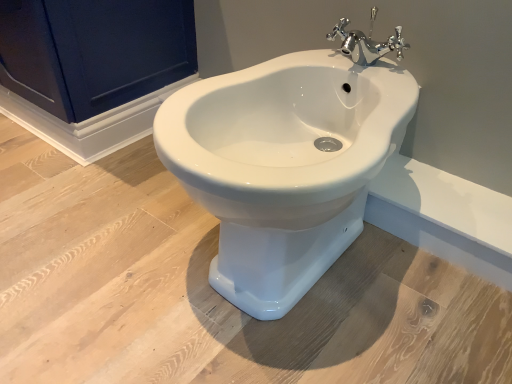
Question: Considering the relative sizes of matte dark blue cabinet at upper left and chrome metallic faucet at upper center in the image provided, is matte dark blue cabinet at upper left bigger than chrome metallic faucet at upper center?

Choices:
 (A) yes
 (B) no

Answer: (A)

Question: Is the position of matte dark blue cabinet at upper left less distant than that of chrome metallic faucet at upper center?

Choices:
 (A) no
 (B) yes

Answer: (A)

Question: Is matte dark blue cabinet at upper left beside chrome metallic faucet at upper center?

Choices:
 (A) no
 (B) yes

Answer: (A)

Question: Could you tell me if matte dark blue cabinet at upper left is facing chrome metallic faucet at upper center?

Choices:
 (A) yes
 (B) no

Answer: (B)

Question: Is chrome metallic faucet at upper center at the back of matte dark blue cabinet at upper left?

Choices:
 (A) no
 (B) yes

Answer: (A)

Question: From a real-world perspective, does matte dark blue cabinet at upper left stand above chrome metallic faucet at upper center?

Choices:
 (A) yes
 (B) no

Answer: (B)

Question: From a real-world perspective, is white glossy bidet at center over matte dark blue cabinet at upper left?

Choices:
 (A) no
 (B) yes

Answer: (A)

Question: Is white glossy bidet at center at the left side of matte dark blue cabinet at upper left?

Choices:
 (A) no
 (B) yes

Answer: (A)

Question: Is white glossy bidet at center taller than matte dark blue cabinet at upper left?

Choices:
 (A) yes
 (B) no

Answer: (A)

Question: Is white glossy bidet at center further to the viewer compared to matte dark blue cabinet at upper left?

Choices:
 (A) no
 (B) yes

Answer: (A)

Question: Does white glossy bidet at center lie in front of matte dark blue cabinet at upper left?

Choices:
 (A) no
 (B) yes

Answer: (B)

Question: Considering the relative sizes of white glossy bidet at center and matte dark blue cabinet at upper left in the image provided, is white glossy bidet at center smaller than matte dark blue cabinet at upper left?

Choices:
 (A) yes
 (B) no

Answer: (A)

Question: From the image's perspective, does chrome metallic faucet at upper center appear lower than matte dark blue cabinet at upper left?

Choices:
 (A) no
 (B) yes

Answer: (B)